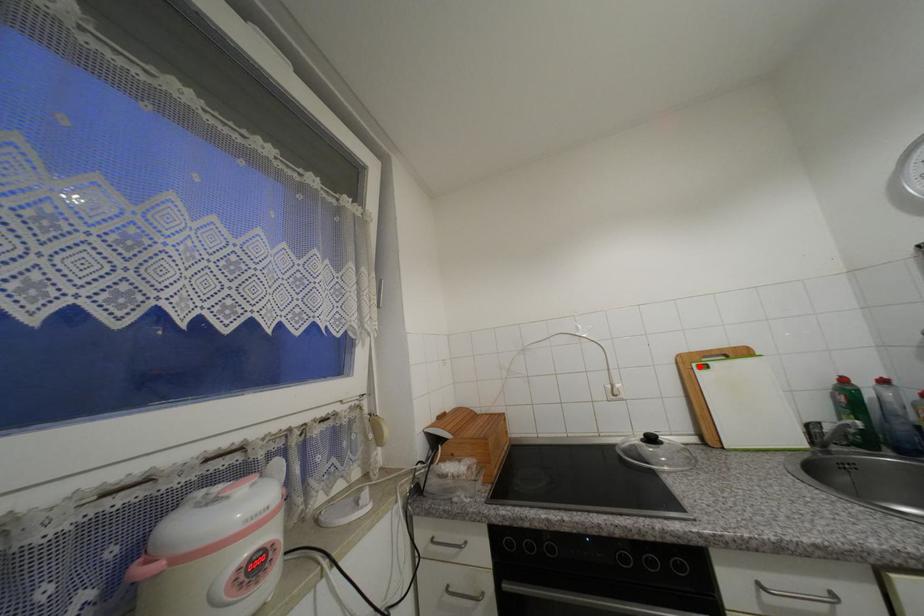
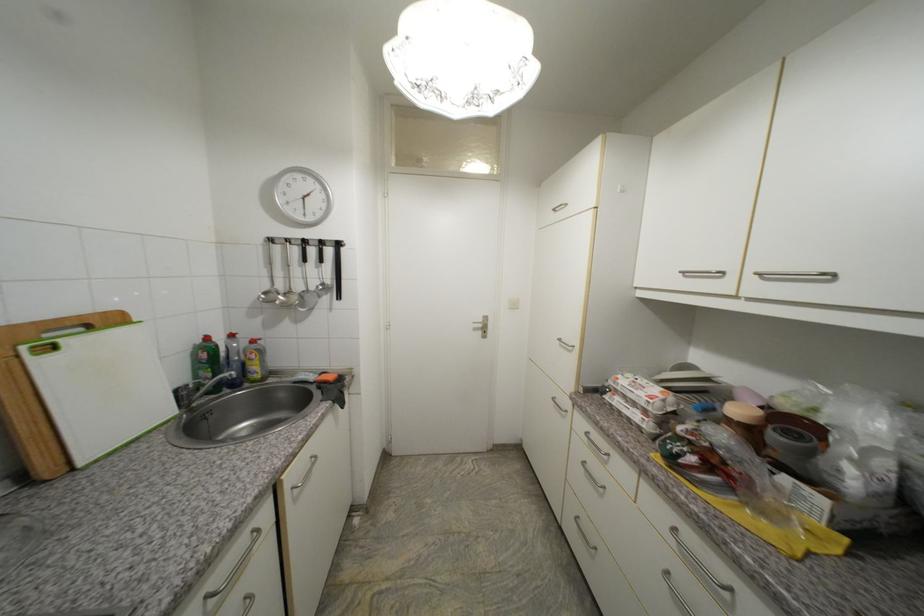
In the second image, find the point that corresponds to the highlighted location in the first image.

(30, 349)